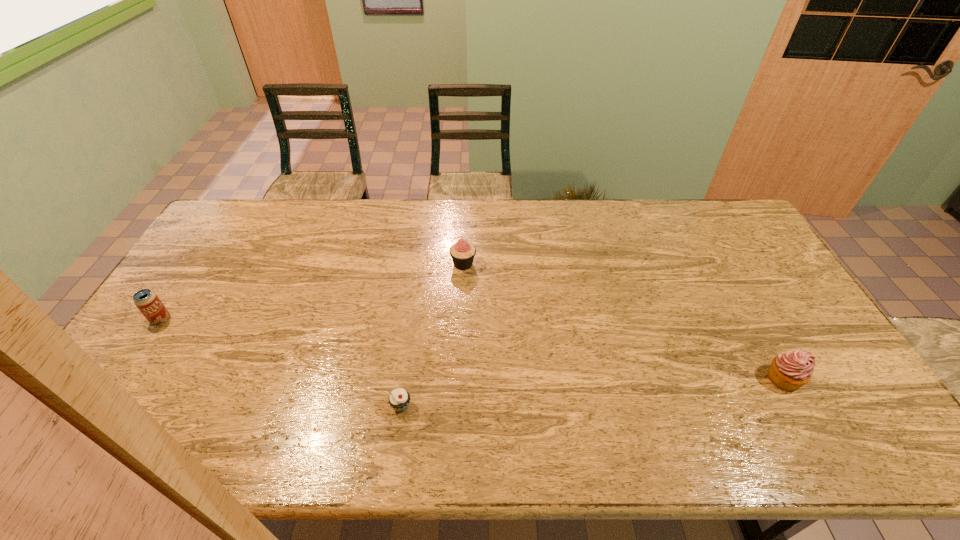
This screenshot has width=960, height=540. In order to click on the third object from left to right in this screenshot , I will do `click(462, 253)`.

Where is `the farthest object`? The width and height of the screenshot is (960, 540). the farthest object is located at coordinates (462, 253).

Locate an element on the screen. The image size is (960, 540). the rightmost object is located at coordinates (789, 371).

Image resolution: width=960 pixels, height=540 pixels. In order to click on the second nearest cupcake in this screenshot , I will do `click(789, 371)`.

Where is `the third nearest object`? This screenshot has height=540, width=960. the third nearest object is located at coordinates (147, 301).

This screenshot has width=960, height=540. What are the coordinates of `beer can` in the screenshot? It's located at click(147, 301).

Image resolution: width=960 pixels, height=540 pixels. What are the coordinates of `the nearest object` in the screenshot? It's located at (x=399, y=399).

I want to click on the third object from right to left, so click(x=399, y=399).

Where is `vacant space situated on the right of the farthest object`? Image resolution: width=960 pixels, height=540 pixels. vacant space situated on the right of the farthest object is located at coordinates (492, 264).

Identify the location of blank space located on the left of the second nearest object. Image resolution: width=960 pixels, height=540 pixels. (732, 379).